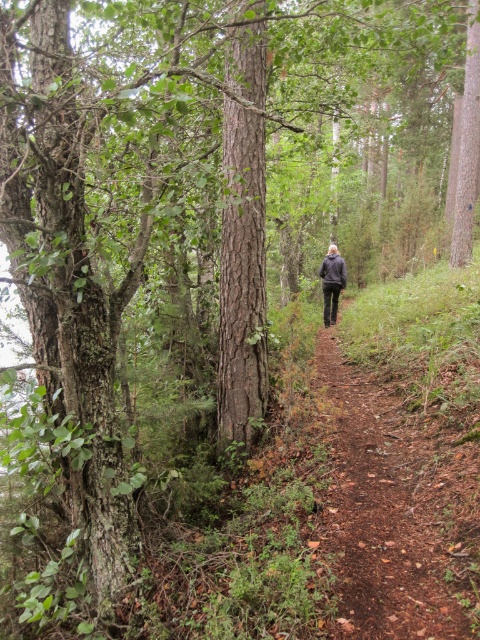
You are standing at the start of the forest path and see the brown dirt path at center and the dark gray jacket at center. Which object is closer to you?

The brown dirt path at center is closer to you because it is in front of the dark gray jacket at center.

You are standing at the start of the brown dirt path at center and want to follow the person wearing the dark gray jacket at center. Which direction should you walk to stay on the path and follow them?

The brown dirt path at center is located below the dark gray jacket at center, so you should walk forward along the path towards the direction the person is moving, staying on the path below the jacket.

You are standing at the start of the dirt path in the forest. You see the brown dirt path at center and the dark gray jacket at center. Which object is positioned to the left of the other?

The brown dirt path at center is to the left of the dark gray jacket at center.